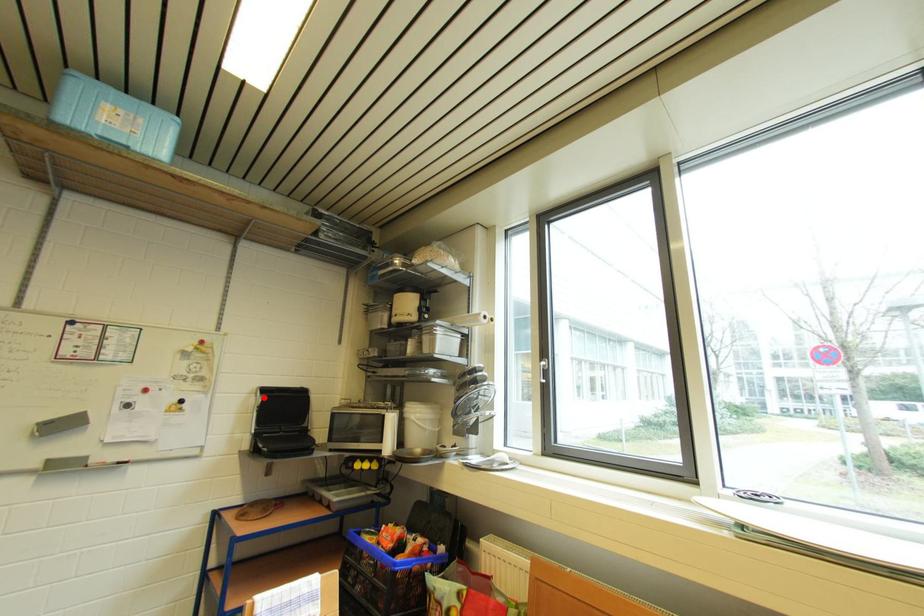
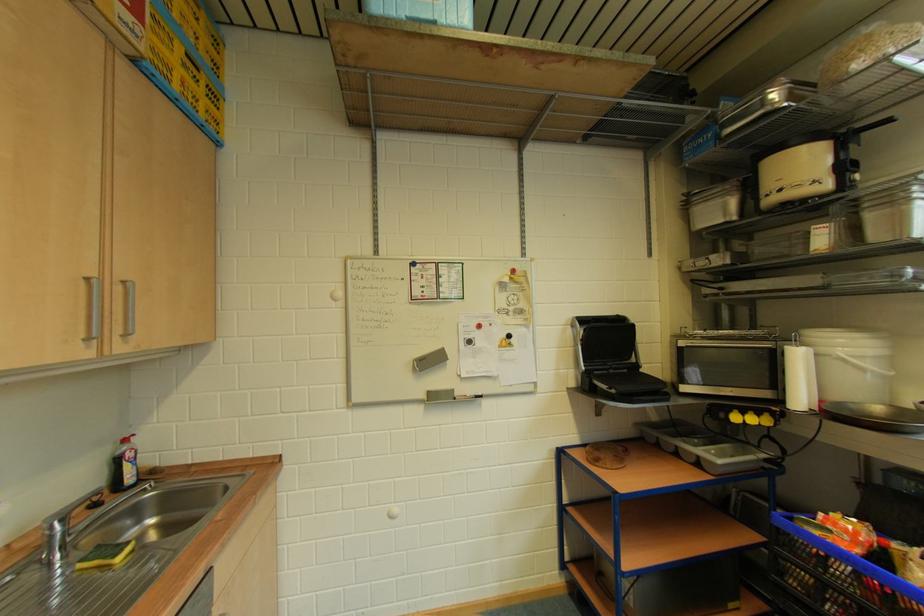
Find the pixel in the second image that matches the highlighted location in the first image.

(579, 329)